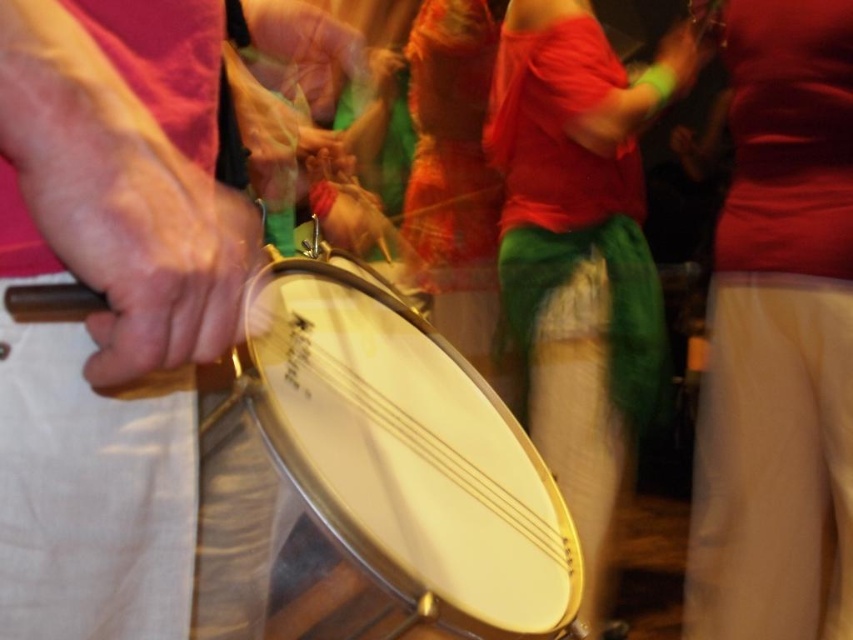
Question: Among these objects, which one is nearest to the camera?

Choices:
 (A) matte green scarf at upper center
 (B) matte black drumstick at left
 (C) metallic drum at center

Answer: (B)

Question: Which point is closer to the camera taking this photo?

Choices:
 (A) (178, 336)
 (B) (669, 38)
 (C) (405, 522)

Answer: (A)

Question: Is matte black drumstick at left in front of matte green scarf at upper center?

Choices:
 (A) no
 (B) yes

Answer: (B)

Question: Which point appears farthest from the camera in this image?

Choices:
 (A) (149, 224)
 (B) (677, 86)
 (C) (445, 561)

Answer: (B)

Question: Does metallic drum at center appear over matte green scarf at upper center?

Choices:
 (A) no
 (B) yes

Answer: (A)

Question: Can you confirm if metallic drum at center is thinner than matte green scarf at upper center?

Choices:
 (A) no
 (B) yes

Answer: (A)